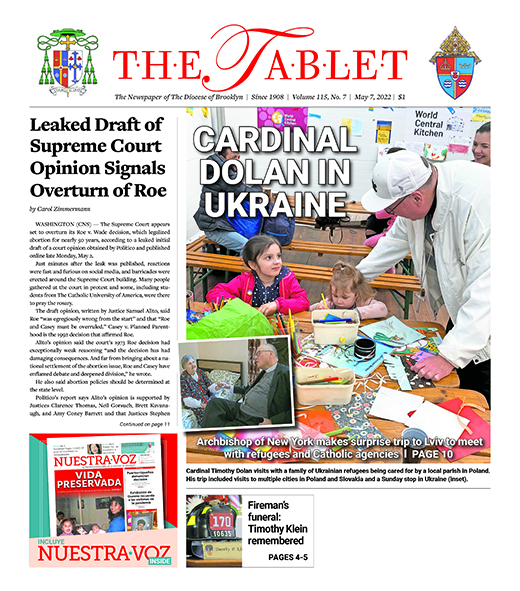
This screenshot has width=520, height=591. In order to click on wall in this screenshot , I will do `click(367, 141)`.